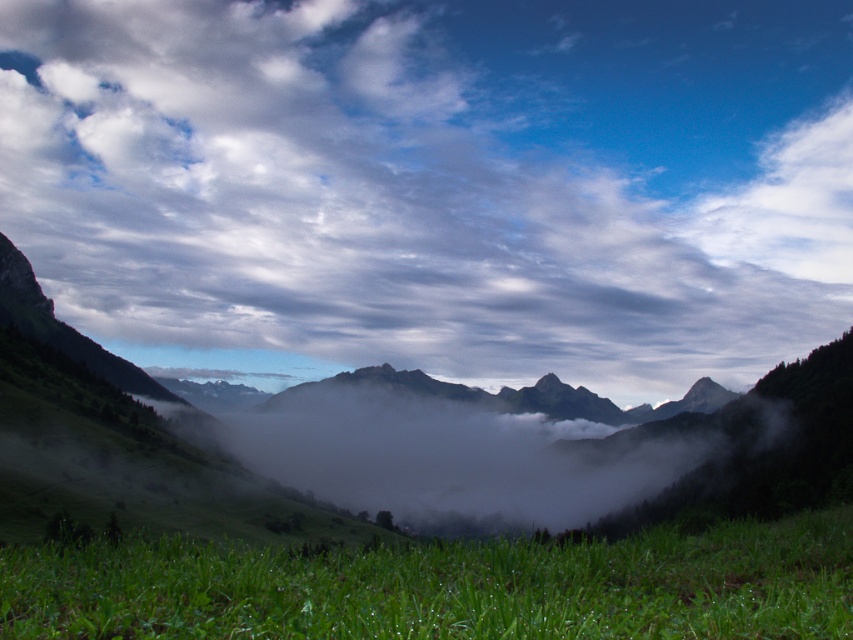
Question: Is cloudy sky at upper center behind green grassy at lower center?

Choices:
 (A) yes
 (B) no

Answer: (A)

Question: Is cloudy sky at upper center below green grassy at lower center?

Choices:
 (A) no
 (B) yes

Answer: (A)

Question: Which point is farther to the camera?

Choices:
 (A) (759, 522)
 (B) (418, 333)

Answer: (B)

Question: Can you confirm if cloudy sky at upper center is positioned to the right of green grassy at lower center?

Choices:
 (A) no
 (B) yes

Answer: (A)